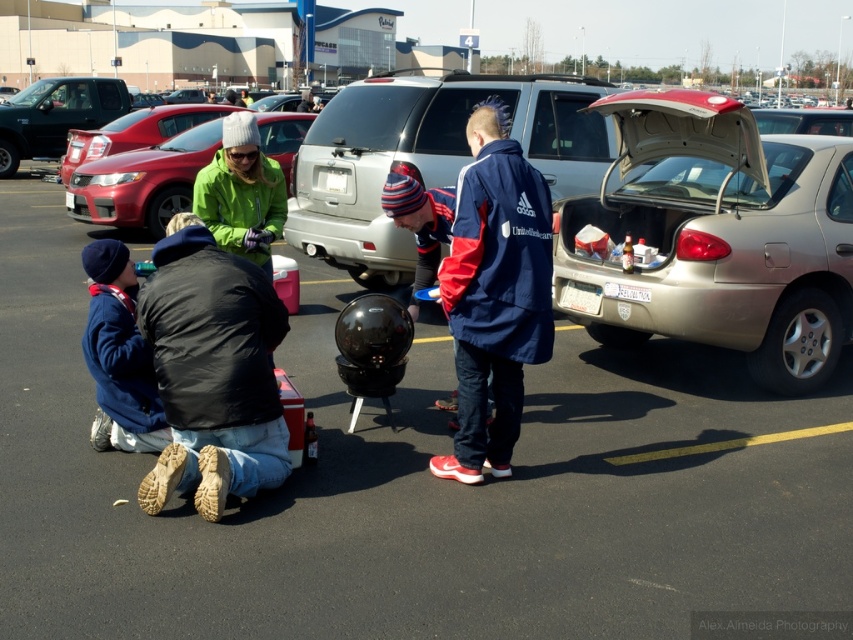
Is navy blue fabric jacket at center shorter than green fleece jacket at upper center?

No.

Is navy blue fabric jacket at center wider than green fleece jacket at upper center?

Correct, the width of navy blue fabric jacket at center exceeds that of green fleece jacket at upper center.

Which is behind, point (442, 474) or point (267, 264)?

The point (267, 264) is behind.

This screenshot has width=853, height=640. I want to click on navy blue fabric jacket at center, so click(x=494, y=292).

Is metallic silver suv at upper left wider than green fleece jacket at center?

Incorrect, metallic silver suv at upper left's width does not surpass green fleece jacket at center's.

Is the position of metallic silver suv at upper left less distant than that of green fleece jacket at center?

Yes, it is.

Describe the element at coordinates (55, 115) in the screenshot. The image size is (853, 640). I see `metallic silver suv at upper left` at that location.

At what (x,y) coordinates should I click in order to perform the action: click on metallic silver suv at upper left. Please return your answer as a coordinate pair (x, y). Looking at the image, I should click on (55, 115).

Who is more forward, (267, 113) or (50, 150)?

Point (267, 113) is more forward.

Between green matte jacket at upper center and metallic silver suv at upper left, which one has less height?

green matte jacket at upper center is shorter.

Does point (141, 186) lie behind point (42, 97)?

No.

What are the coordinates of `green matte jacket at upper center` in the screenshot? It's located at (142, 180).